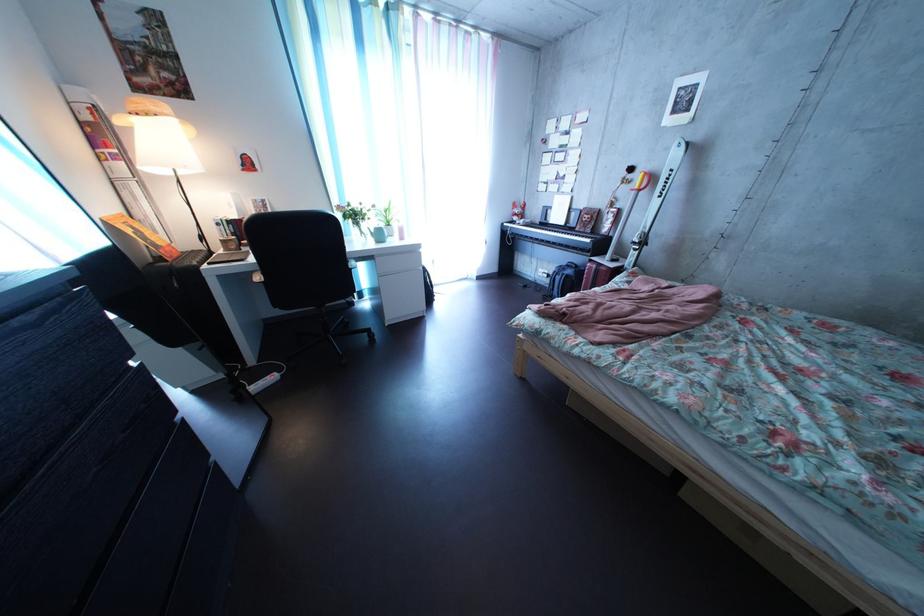
This screenshot has height=616, width=924. I want to click on black piano key, so click(560, 237).